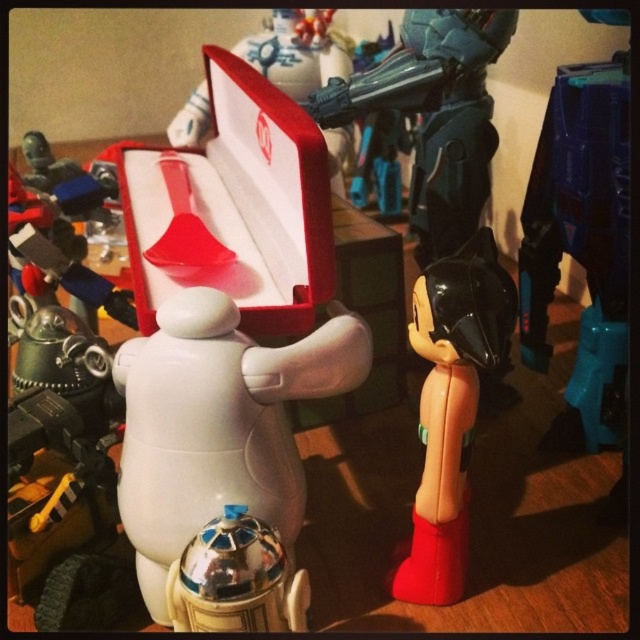
You are organizing a display of collectible items and need to ensure proper visibility. Given the black glossy action figure at center and the red velvet box at center, which item should be placed lower on the shelf to avoid blocking the view of the other?

The black glossy action figure at center is shorter than the red velvet box at center, so placing the action figure lower will prevent it from being obscured by the taller box.

You are organizing a toy display and need to place the white plastic robot at center and the matte plastic spoon at center on a shelf. If the shelf has a width of 10 cm, can both items fit side by side without overlapping?

The white plastic robot at center is wider than the matte plastic spoon at center. However, since the total width of both items combined is not provided, it is impossible to determine if they can fit on a 10 cm shelf without overlapping.

You are organizing a toy shelf and need to place both the black glossy action figure at center and the metallic blue robot at upper center. Based on their sizes, which one should you place first to maximize shelf space efficiency?

The black glossy action figure at center occupies less space than the metallic blue robot at upper center, so you should place the metallic blue robot at upper center first to utilize the space more efficiently.